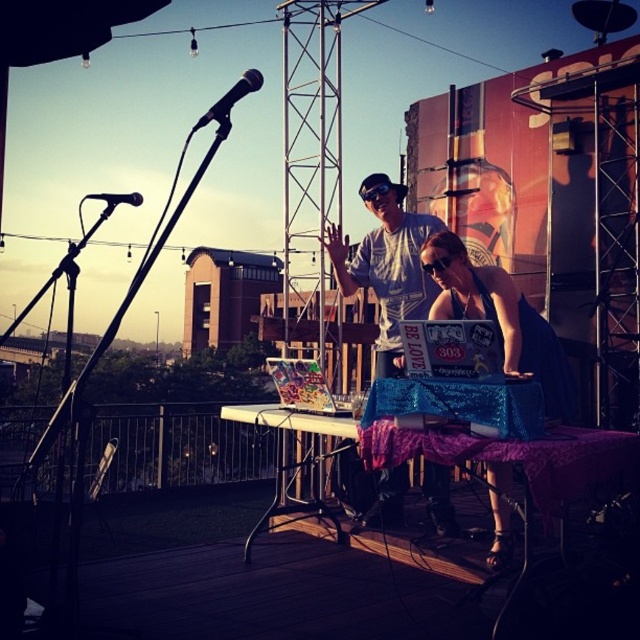
Is point (211, 120) positioned behind point (113, 205)?

Yes, it is behind point (113, 205).

Is point (204, 115) closer to viewer compared to point (132, 195)?

Yes, point (204, 115) is closer to viewer.

At what (x,y) coordinates should I click in order to perform the action: click on black matte microphone at upper center. Please return your answer as a coordinate pair (x, y). Looking at the image, I should click on (230, 97).

How distant is shiny black dress at center from black matte microphone at upper left?

shiny black dress at center is 6.62 feet from black matte microphone at upper left.

Is shiny black dress at center to the right of black matte microphone at upper left from the viewer's perspective?

Yes, shiny black dress at center is to the right of black matte microphone at upper left.

What do you see at coordinates (500, 317) in the screenshot? The image size is (640, 640). I see `shiny black dress at center` at bounding box center [500, 317].

Find the location of a particular element. This screenshot has width=640, height=640. shiny black dress at center is located at coordinates (500, 317).

Which is behind, point (401, 490) or point (500, 545)?

The point (401, 490) is more distant.

Does matte white t-shirt at center appear under shiny black dress at center?

Incorrect, matte white t-shirt at center is not positioned below shiny black dress at center.

Find the location of a particular element. The width and height of the screenshot is (640, 640). matte white t-shirt at center is located at coordinates (387, 266).